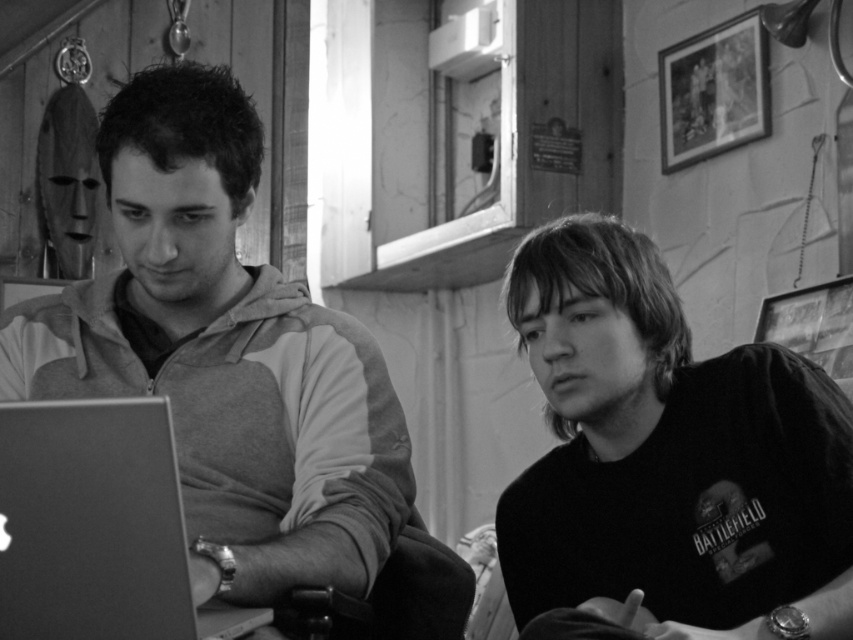
You are standing in the room shown in the image. You need to locate the matte gray hoodie at left. Where exactly is it positioned in the room?

The matte gray hoodie at left is located at point 0.556 on the x axis and 0.264 on the y axis.

You are taking a photo of two people sitting in a room. The first person is at point (132, 131) and the second person is at point (36, 602). Which person is closer to the camera?

The person at point (132, 131) is closer to the camera than the person at point (36, 602) because point (132, 131) is further to the camera than point (36, 602).